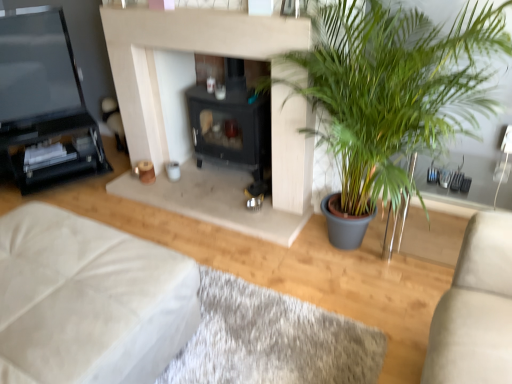
Where is `vacant region below green leafy plant at right (from a real-world perspective)`? The width and height of the screenshot is (512, 384). vacant region below green leafy plant at right (from a real-world perspective) is located at coordinates (350, 263).